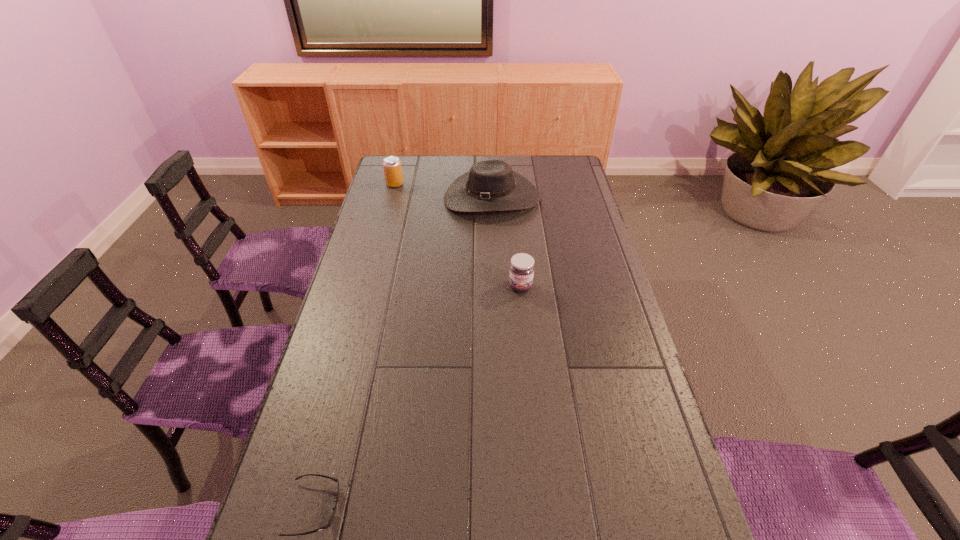
Find the location of a particular element. The image size is (960, 540). free area in between the pop (soda) and the nearest object is located at coordinates (354, 346).

Image resolution: width=960 pixels, height=540 pixels. Identify the location of vacant area that lies between the jam and the pop (soda). coord(458,235).

I want to click on empty space that is in between the pop (soda) and the jam, so click(458, 235).

Find the location of `empty location between the pop (soda) and the second nearest object`. empty location between the pop (soda) and the second nearest object is located at coordinates (458, 235).

I want to click on free space between the shortest object and the cowboy hat, so click(x=403, y=353).

What are the coordinates of `free space between the third farthest object and the nearest object` in the screenshot? It's located at (418, 397).

You are a GUI agent. You are given a task and a screenshot of the screen. Output one action in this format:
    pyautogui.click(x=<x>, y=<y>)
    Task: Click on the free space that is in between the tallest object and the shortest object
    Image resolution: width=960 pixels, height=540 pixels.
    Given the screenshot: What is the action you would take?
    pyautogui.click(x=403, y=353)

You are a GUI agent. You are given a task and a screenshot of the screen. Output one action in this format:
    pyautogui.click(x=<x>, y=<y>)
    Task: Click on the vacant point located between the cowboy hat and the nearest object
    This screenshot has width=960, height=540.
    Given the screenshot: What is the action you would take?
    pyautogui.click(x=403, y=353)

Choose which object is the second nearest neighbor to the pop (soda). Please provide its 2D coordinates. Your answer should be formatted as a tuple, i.e. [(x, y)], where the tuple contains the x and y coordinates of a point satisfying the conditions above.

[(521, 272)]

Identify which object is located as the second nearest to the pop (soda). Please provide its 2D coordinates. Your answer should be formatted as a tuple, i.e. [(x, y)], where the tuple contains the x and y coordinates of a point satisfying the conditions above.

[(521, 272)]